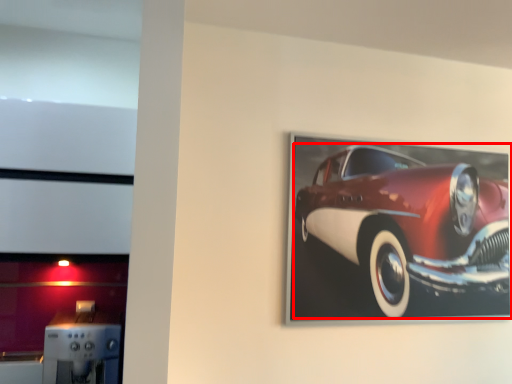
Question: From the image's perspective, where is car (annotated by the red box) located in relation to appliance in the image?

Choices:
 (A) below
 (B) above

Answer: (B)